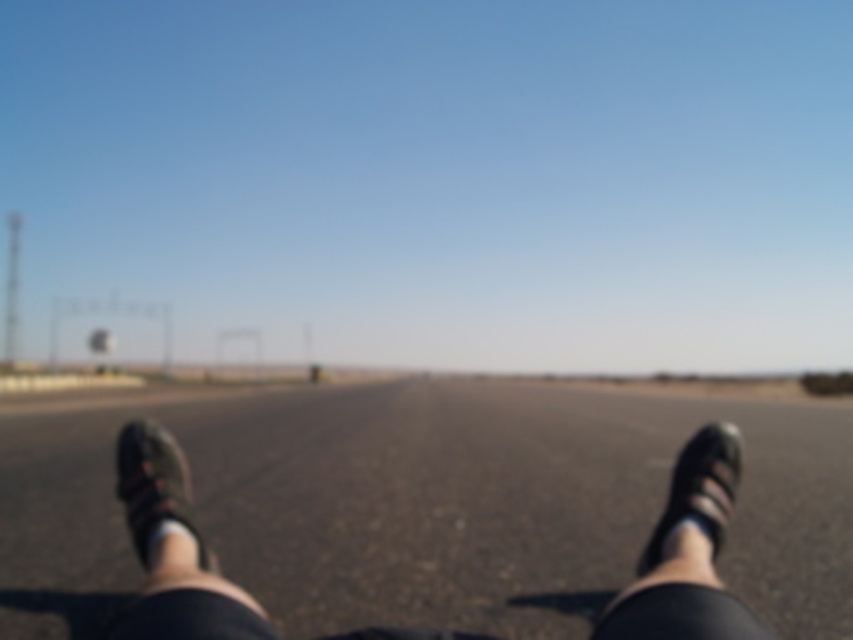
Question: Considering the relative positions of asphalt road at center and white fabric sock at lower center in the image provided, where is asphalt road at center located with respect to white fabric sock at lower center?

Choices:
 (A) above
 (B) below

Answer: (B)

Question: Is asphalt road at center above matte brown sandal at lower left?

Choices:
 (A) no
 (B) yes

Answer: (A)

Question: Which point is farther to the camera?

Choices:
 (A) matte brown sandal at lower left
 (B) asphalt road at center

Answer: (B)

Question: Which point appears farthest from the camera in this image?

Choices:
 (A) [235, 419]
 (B) [737, 432]

Answer: (A)

Question: Which object is the farthest from the black suede shoe at lower right?

Choices:
 (A) asphalt road at center
 (B) matte brown sandal at lower left
 (C) white fabric sock at lower center

Answer: (A)

Question: Can you confirm if black suede shoe at lower right is positioned to the right of white fabric sock at lower center?

Choices:
 (A) no
 (B) yes

Answer: (B)